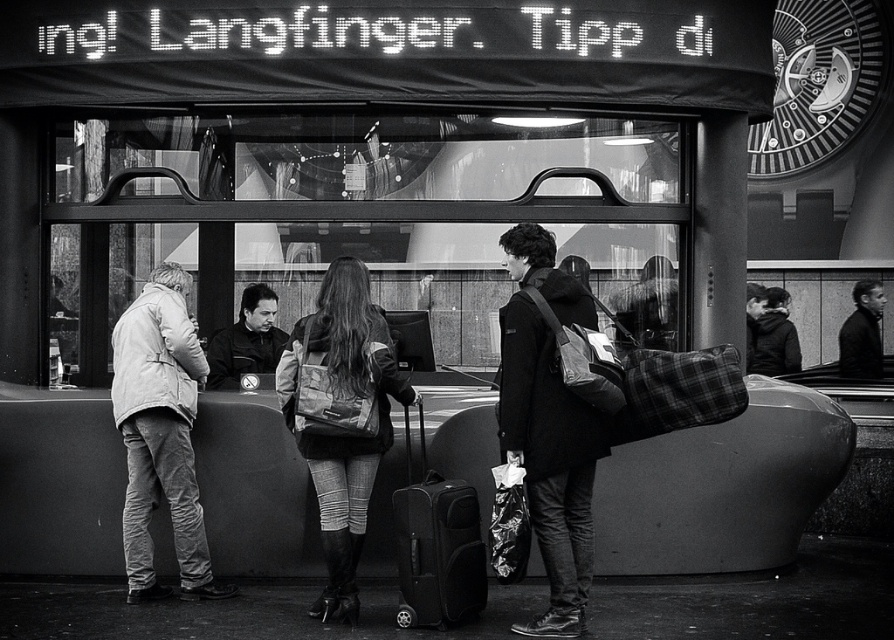
You are a photographer standing at the train station. You want to take a photo of the light beige jacket at left and the leather jacket at center. Which jacket is closer to the camera?

The light beige jacket at left is positioned under the leather jacket at center, so the leather jacket at center is closer to the camera.

You are standing at the train station and want to reach the point marked as point (149, 344). If your walking speed is 1.2 meters per second, how many seconds will it take you to reach that point?

The distance between you and point (149, 344) is 6.54 meters. At a speed of 1.2 meters per second, it will take approximately 5.45 seconds to reach the point.

You are standing at the train station and see the smooth black jacket at center. If you want to reach it within 10 meters, can you get there?

The smooth black jacket at center is 11.12 meters away from the camera, so you cannot reach it within 10 meters.